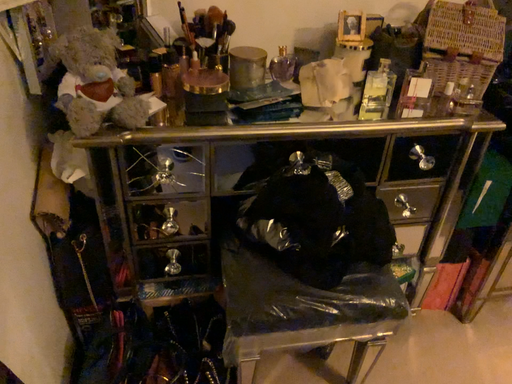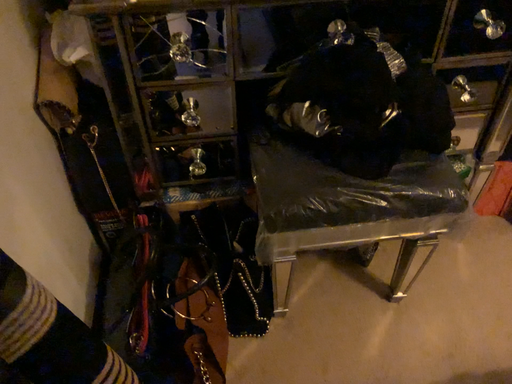
Question: Which way did the camera rotate in the video?

Choices:
 (A) rotated downward
 (B) rotated upward

Answer: (A)